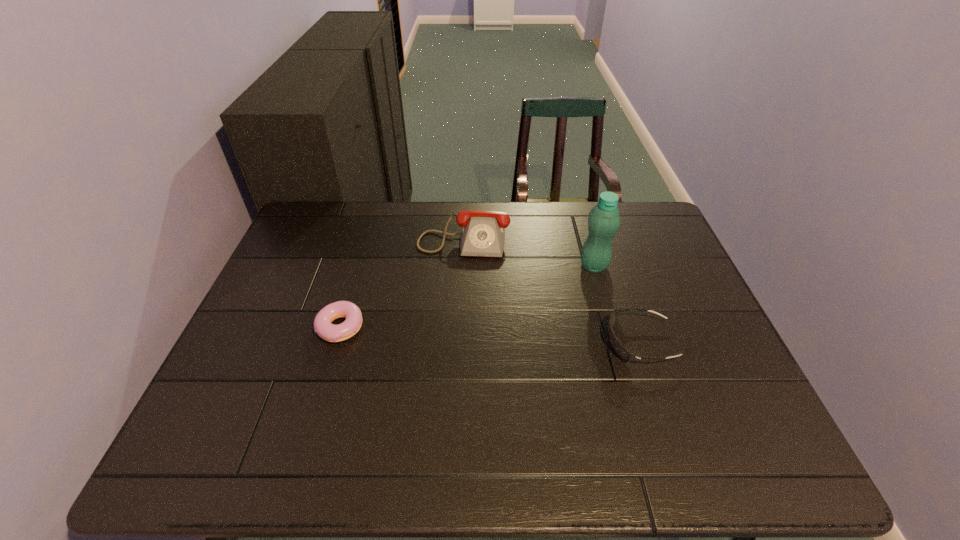
Identify the location of vacant spot on the desktop that is between the leftmost object and the goggles and is positioned at the front cap of the water bottle. This screenshot has height=540, width=960. [x=512, y=336].

I want to click on vacant space on the desktop that is between the leftmost object and the goggles and is positioned on the dial of the telephone, so click(x=451, y=333).